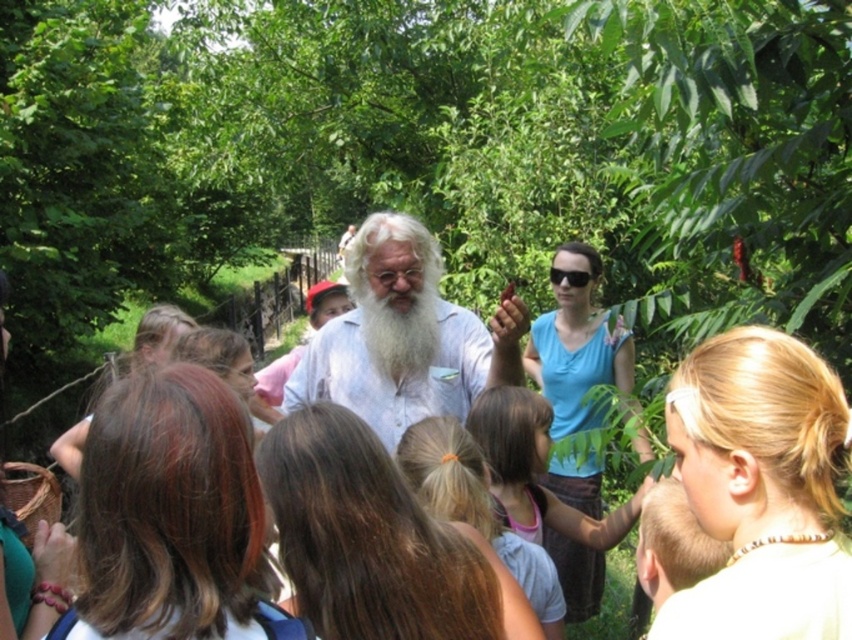
Question: Which of the following is the closest to the observer?

Choices:
 (A) white matte beard at center
 (B) whitewoollybeard at center

Answer: (B)

Question: Estimate the real-world distances between objects in this image. Which object is farther from the brown fabric skirt at center?

Choices:
 (A) blonde hair at center
 (B) white matte beard at center

Answer: (B)

Question: Which of the following is the closest to the observer?

Choices:
 (A) blonde hair at center
 (B) whitewoollybeard at center
 (C) white cotton shirt at center

Answer: (A)

Question: Can you confirm if white cotton shirt at center is bigger than white matte beard at center?

Choices:
 (A) no
 (B) yes

Answer: (A)

Question: Is white matte beard at center to the right of whitewoollybeard at center from the viewer's perspective?

Choices:
 (A) yes
 (B) no

Answer: (A)

Question: Is white cotton shirt at center positioned before blonde hair at center?

Choices:
 (A) no
 (B) yes

Answer: (A)